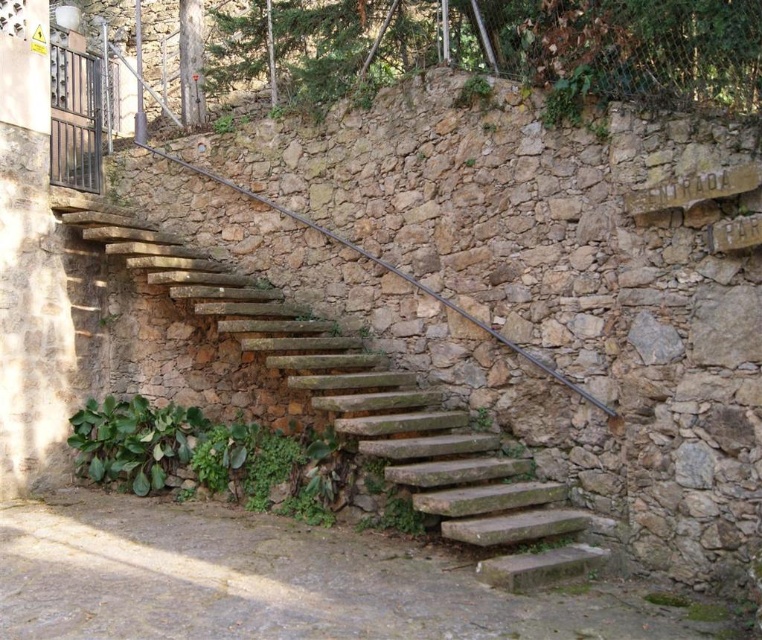
Question: Which point is closer to the camera?

Choices:
 (A) green leafy ivy at upper center
 (B) rustic stone stairs at center

Answer: (B)

Question: Is the position of rustic stone stairs at center more distant than that of brown metal/rustic rail at center?

Choices:
 (A) yes
 (B) no

Answer: (B)

Question: Is rustic stone stairs at center in front of brown metal/rustic rail at center?

Choices:
 (A) yes
 (B) no

Answer: (A)

Question: From the image, what is the correct spatial relationship of green leafy ivy at upper center in relation to brown metal/rustic rail at center?

Choices:
 (A) right
 (B) left

Answer: (A)

Question: Which of these objects is positioned closest to the brown metal/rustic rail at center?

Choices:
 (A) rustic stone stairs at center
 (B) green leafy ivy at upper center

Answer: (B)

Question: Which object is closer to the camera taking this photo?

Choices:
 (A) green leafy ivy at upper center
 (B) rustic stone stairs at center
 (C) brown metal/rustic rail at center

Answer: (B)